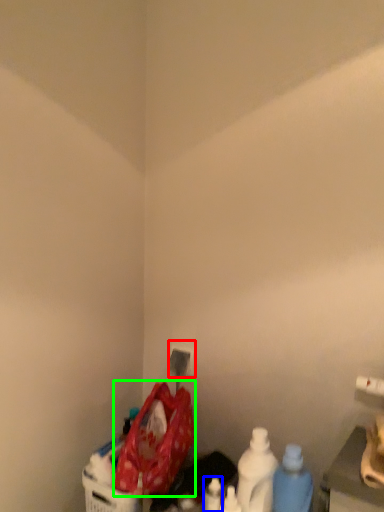
Question: Estimate the real-world distances between objects in this image. Which object is farther from electric outlet (highlighted by a red box), bottle (highlighted by a blue box) or waste (highlighted by a green box)?

Choices:
 (A) bottle
 (B) waste

Answer: (A)